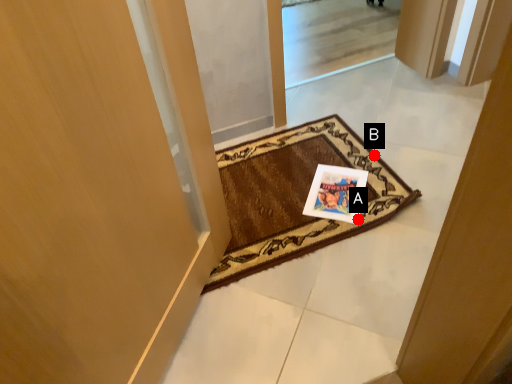
Question: Two points are circled on the image, labeled by A and B beside each circle. Which point appears farthest from the camera in this image?

Choices:
 (A) A is further
 (B) B is further

Answer: (B)